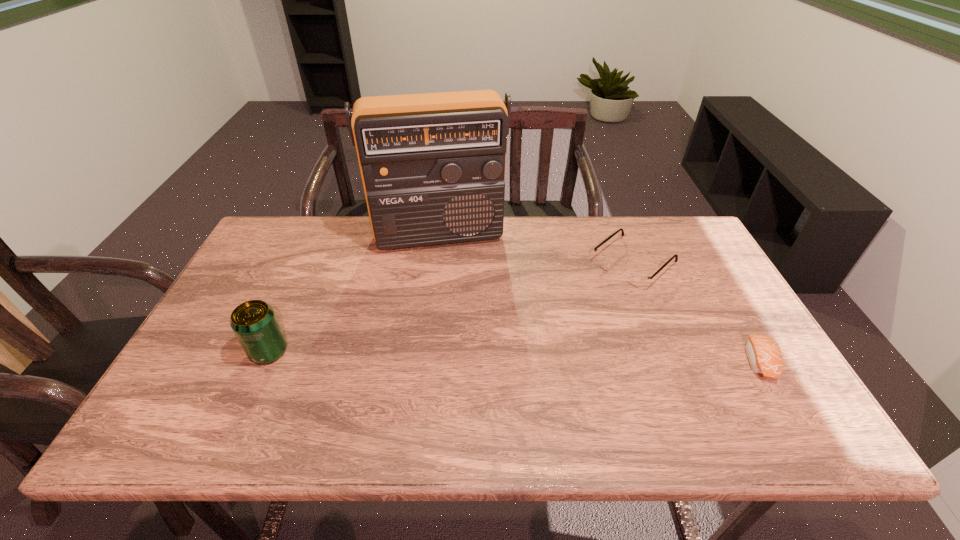
The width and height of the screenshot is (960, 540). In order to click on sushi at the right edge in this screenshot , I will do `click(764, 354)`.

Locate an element on the screen. The image size is (960, 540). spectacles positioned at the right edge is located at coordinates (635, 278).

Locate an element on the screen. object that is at the far right corner is located at coordinates (635, 278).

This screenshot has width=960, height=540. Find the location of `object that is at the near right corner`. object that is at the near right corner is located at coordinates (764, 354).

Locate an element on the screen. vacant space at the far edge of the desktop is located at coordinates point(611,216).

Identify the location of free space at the near edge. The image size is (960, 540). (477, 379).

The width and height of the screenshot is (960, 540). I want to click on free space at the left edge of the desktop, so click(x=215, y=316).

Locate an element on the screen. vacant space at the far right corner of the desktop is located at coordinates (660, 240).

I want to click on vacant region at the near right corner of the desktop, so click(775, 390).

Find the location of a particular element. This screenshot has width=960, height=540. free space between the leftmost object and the tallest object is located at coordinates (354, 293).